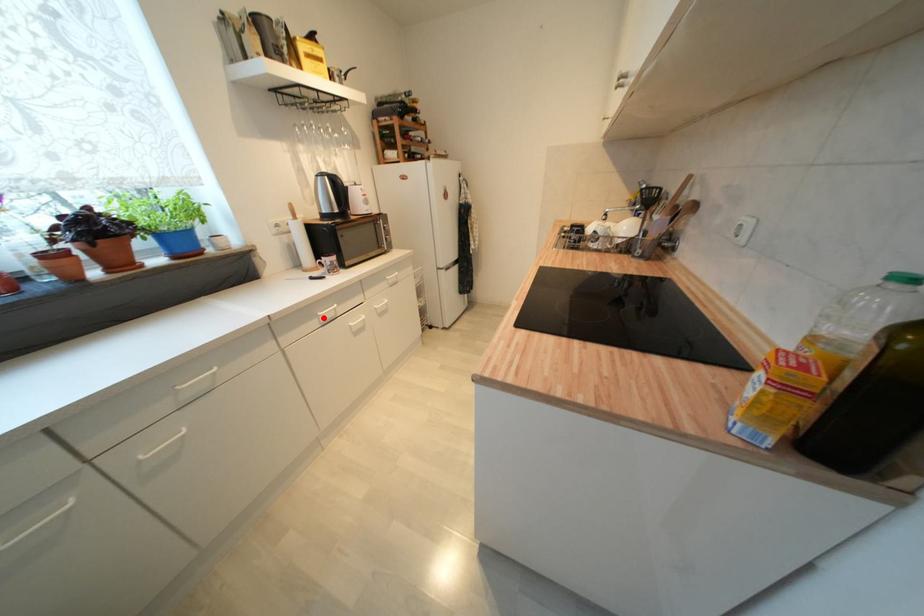
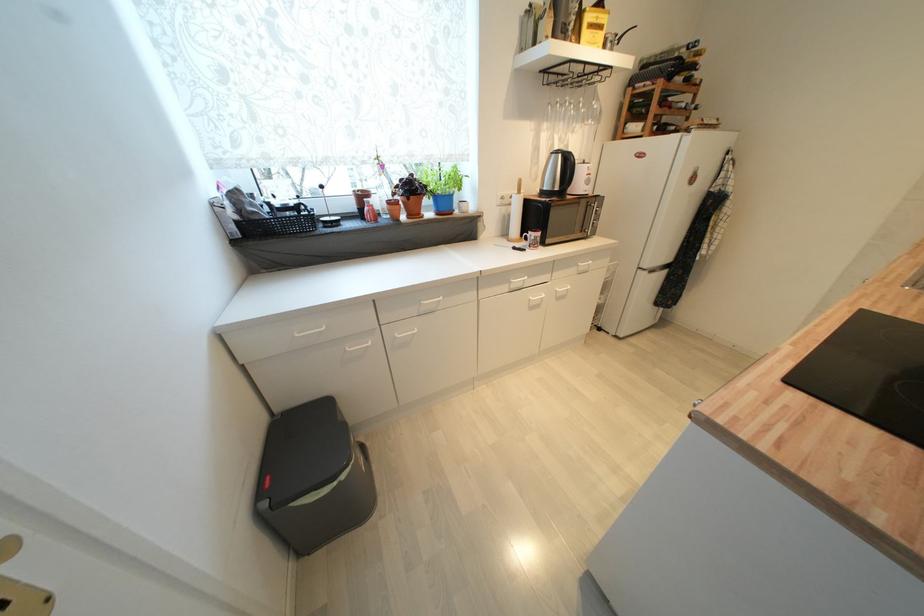
In the second image, find the point that corresponds to the highlighted location in the first image.

(516, 284)